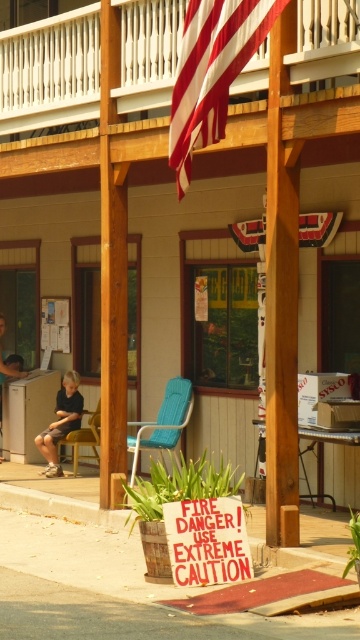
Question: In this image, where is dark brown leather shorts at lower left located relative to dark blue jeans at left?

Choices:
 (A) above
 (B) below

Answer: (B)

Question: Which point appears farthest from the camera in this image?

Choices:
 (A) click(x=156, y=436)
 (B) click(x=96, y=412)

Answer: (B)

Question: Among these objects, which one is nearest to the camera?

Choices:
 (A) dark brown leather shorts at lower left
 (B) red-white striped flag at upper center
 (C) yellow fabric chair at left
 (D) blue plastic chair at center

Answer: (B)

Question: Is blue plastic chair at center positioned before dark brown leather shorts at lower left?

Choices:
 (A) no
 (B) yes

Answer: (B)

Question: Which point is farther to the camera?

Choices:
 (A) yellow fabric chair at left
 (B) dark brown leather shorts at lower left

Answer: (B)

Question: Does red-white striped flag at upper center have a larger size compared to dark blue jeans at left?

Choices:
 (A) no
 (B) yes

Answer: (B)